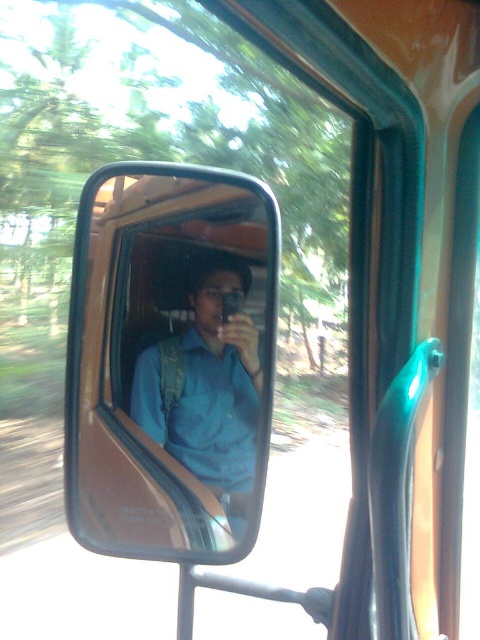
Describe the element at coordinates (170, 362) in the screenshot. I see `black matte mirror at center` at that location.

Who is more forward, (126, 172) or (230, 272)?

Point (126, 172) is in front.

Does point (211, 508) come behind point (190, 413)?

No.

Image resolution: width=480 pixels, height=640 pixels. In order to click on black matte mirror at center in this screenshot , I will do [170, 362].